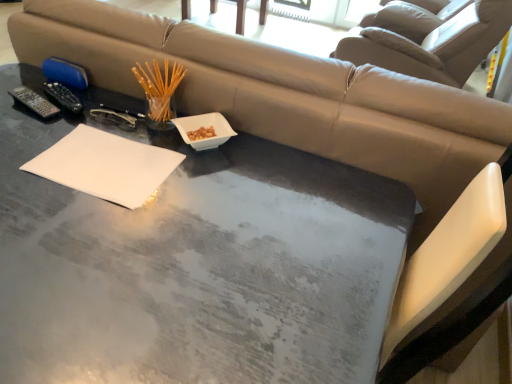
Question: From the image's perspective, is translucent glass chopsticks at upper left on top of white ceramic bowl at center?

Choices:
 (A) yes
 (B) no

Answer: (A)

Question: Is the depth of translucent glass chopsticks at upper left less than that of white ceramic bowl at center?

Choices:
 (A) yes
 (B) no

Answer: (B)

Question: Does translucent glass chopsticks at upper left have a greater height compared to white ceramic bowl at center?

Choices:
 (A) no
 (B) yes

Answer: (B)

Question: Can you confirm if translucent glass chopsticks at upper left is bigger than white ceramic bowl at center?

Choices:
 (A) no
 (B) yes

Answer: (B)

Question: Considering the relative positions of translucent glass chopsticks at upper left and white ceramic bowl at center in the image provided, is translucent glass chopsticks at upper left to the right of white ceramic bowl at center from the viewer's perspective?

Choices:
 (A) yes
 (B) no

Answer: (B)

Question: From the image's perspective, is translucent glass chopsticks at upper left located beneath white ceramic bowl at center?

Choices:
 (A) yes
 (B) no

Answer: (B)

Question: Would you say wooden chair at upper center contains black plastic remote at left?

Choices:
 (A) no
 (B) yes

Answer: (A)

Question: Is wooden chair at upper center in contact with black plastic remote at left?

Choices:
 (A) no
 (B) yes

Answer: (A)

Question: Can you confirm if wooden chair at upper center is taller than black plastic remote at left?

Choices:
 (A) yes
 (B) no

Answer: (A)

Question: Is wooden chair at upper center wider than black plastic remote at left?

Choices:
 (A) no
 (B) yes

Answer: (B)

Question: Does wooden chair at upper center have a smaller size compared to black plastic remote at left?

Choices:
 (A) no
 (B) yes

Answer: (A)

Question: Does wooden chair at upper center come in front of black plastic remote at left?

Choices:
 (A) no
 (B) yes

Answer: (A)

Question: Can you confirm if wooden chair at upper center is smaller than white ceramic bowl at center?

Choices:
 (A) no
 (B) yes

Answer: (A)